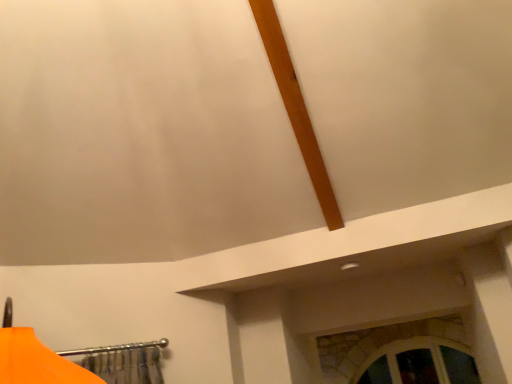
Describe the element at coordinates (421, 363) in the screenshot. I see `white glass window at lower right` at that location.

The height and width of the screenshot is (384, 512). I want to click on white glass window at lower right, so click(x=421, y=363).

Where is `white glass window at lower right`? The height and width of the screenshot is (384, 512). white glass window at lower right is located at coordinates (421, 363).